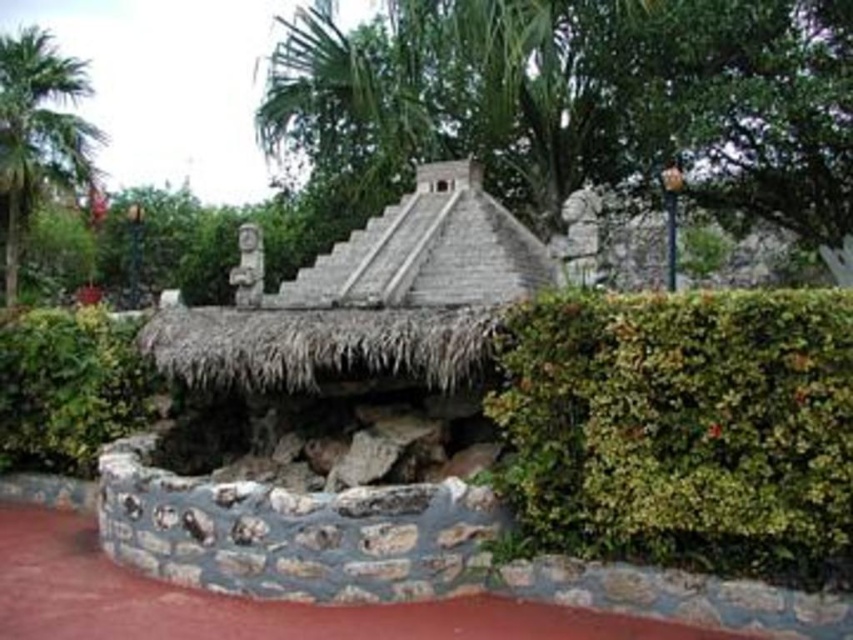
Looking at this image, you are standing in front of the pyramid and want to take a photo. There are two points marked in the image, point (581,429) and point (10,76). Which point will appear larger in your photo?

Point (581,429) is closer to the camera than point (10,76), so it will appear larger in the photo.

You are standing in front of the Mayan pyramid and want to place a small offering. You have two points marked on the pyramid structure at coordinates point (497, 154) and point (15, 371). Which point is closer to you so you can easily reach it without climbing?

Point (497, 154) is further to the viewer than point (15, 371), so the point (15, 371) is closer and easier to reach without climbing.